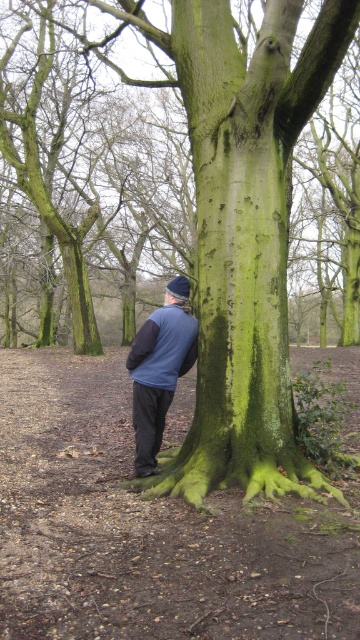
Question: Which point is farther from the camera taking this photo?

Choices:
 (A) (140, 371)
 (B) (159, 360)

Answer: (A)

Question: Which point is farther from the camera taking this photo?

Choices:
 (A) (155, 340)
 (B) (153, 346)

Answer: (A)

Question: Is blue fleece jacket at center below blue fleece sweatshirt at lower center?

Choices:
 (A) yes
 (B) no

Answer: (B)

Question: Can you confirm if blue fleece jacket at center is positioned to the left of blue fleece sweatshirt at lower center?

Choices:
 (A) no
 (B) yes

Answer: (A)

Question: Can you confirm if blue fleece jacket at center is positioned above blue fleece sweatshirt at lower center?

Choices:
 (A) no
 (B) yes

Answer: (B)